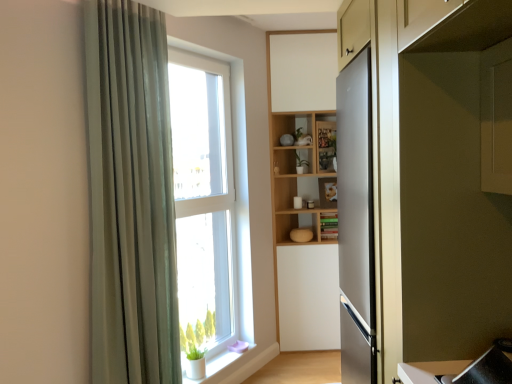
Question: Can you confirm if green fabric curtain at left is smaller than white matte window sill at lower left?

Choices:
 (A) no
 (B) yes

Answer: (A)

Question: Is green fabric curtain at left at the left side of white matte window sill at lower left?

Choices:
 (A) no
 (B) yes

Answer: (B)

Question: Can you see green fabric curtain at left touching white matte window sill at lower left?

Choices:
 (A) yes
 (B) no

Answer: (B)

Question: From a real-world perspective, is green fabric curtain at left physically above white matte window sill at lower left?

Choices:
 (A) no
 (B) yes

Answer: (B)

Question: Is green fabric curtain at left in front of white matte window sill at lower left?

Choices:
 (A) yes
 (B) no

Answer: (A)

Question: In the image, is green matte cabinet at center positioned in front of or behind green fabric curtain at left?

Choices:
 (A) front
 (B) behind

Answer: (B)

Question: Looking at the image, does green matte cabinet at center seem bigger or smaller compared to green fabric curtain at left?

Choices:
 (A) small
 (B) big

Answer: (A)

Question: In the image, is green matte cabinet at center on the left side or the right side of green fabric curtain at left?

Choices:
 (A) right
 (B) left

Answer: (A)

Question: Do you think green matte cabinet at center is within green fabric curtain at left, or outside of it?

Choices:
 (A) inside
 (B) outside

Answer: (B)

Question: From the image's perspective, is green matte plant at center positioned above or below clear glass window at center?

Choices:
 (A) below
 (B) above

Answer: (B)

Question: In terms of height, does green matte plant at center look taller or shorter compared to clear glass window at center?

Choices:
 (A) tall
 (B) short

Answer: (B)

Question: Would you say green matte plant at center is inside or outside clear glass window at center?

Choices:
 (A) inside
 (B) outside

Answer: (B)

Question: Is green matte plant at center wider or thinner than clear glass window at center?

Choices:
 (A) wide
 (B) thin

Answer: (A)

Question: In the image, is green matte plant at center positioned in front of or behind satin silver refrigerator at right?

Choices:
 (A) front
 (B) behind

Answer: (B)

Question: Looking at the image, does green matte plant at center seem bigger or smaller compared to satin silver refrigerator at right?

Choices:
 (A) big
 (B) small

Answer: (B)